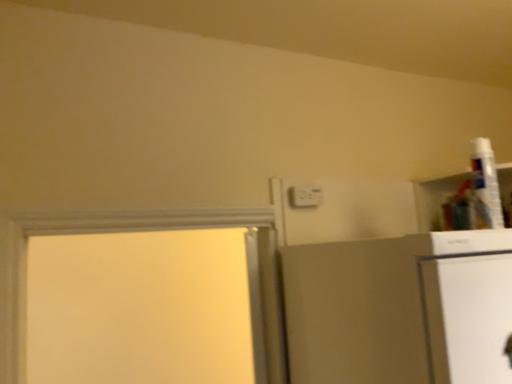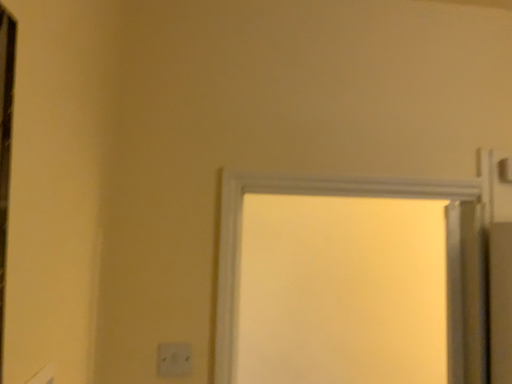
Question: Which way did the camera rotate in the video?

Choices:
 (A) rotated right
 (B) rotated left

Answer: (B)